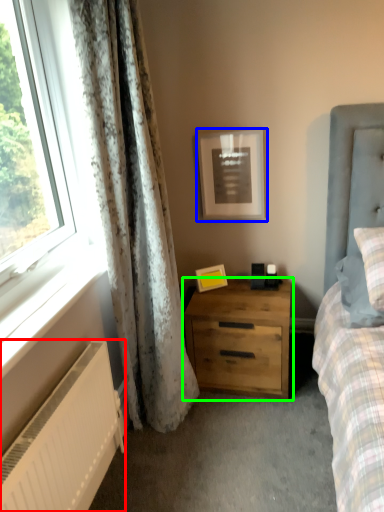
Question: Which object is positioned farthest from radiator (highlighted by a red box)? Select from picture frame (highlighted by a blue box) and nightstand (highlighted by a green box).

Choices:
 (A) picture frame
 (B) nightstand

Answer: (A)